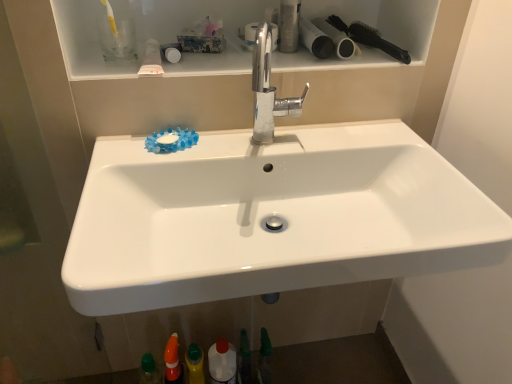
Question: Which direction should I rotate to look at metallic cylindrical container at upper center, arranged as the first toiletry when viewed from the top, — up or down?

Choices:
 (A) down
 (B) up

Answer: (B)

Question: Is the position of black plastic brush at upper right more distant than that of metallic cylindrical container at upper center, the 5th toiletry positioned from the left?

Choices:
 (A) yes
 (B) no

Answer: (B)

Question: From the image's perspective, is black plastic brush at upper right beneath metallic cylindrical container at upper center, positioned as the fifth toiletry in bottom-to-top order?

Choices:
 (A) no
 (B) yes

Answer: (A)

Question: Is black plastic brush at upper right shorter than metallic cylindrical container at upper center, positioned as the fifth toiletry in bottom-to-top order?

Choices:
 (A) no
 (B) yes

Answer: (B)

Question: Does black plastic brush at upper right have a smaller size compared to metallic cylindrical container at upper center, arranged as the first toiletry when viewed from the top?

Choices:
 (A) yes
 (B) no

Answer: (B)

Question: Is black plastic brush at upper right to the right of metallic cylindrical container at upper center, arranged as the first toiletry when viewed from the top, from the viewer's perspective?

Choices:
 (A) yes
 (B) no

Answer: (A)

Question: Does black plastic brush at upper right have a greater width compared to metallic cylindrical container at upper center, positioned as the fifth toiletry in bottom-to-top order?

Choices:
 (A) no
 (B) yes

Answer: (B)

Question: From the image's perspective, is matte white toilet paper at upper right, which is counted as the 2th toilet paper, starting from the right, below green matte toothpaste at lower center, which is counted as the fourth toiletry, starting from the bottom?

Choices:
 (A) no
 (B) yes

Answer: (A)

Question: Is matte white toilet paper at upper right, which is counted as the 2th toilet paper, starting from the right, to the left of green matte toothpaste at lower center, marked as the 2th toiletry in a top-to-bottom arrangement, from the viewer's perspective?

Choices:
 (A) no
 (B) yes

Answer: (A)

Question: Is the depth of matte white toilet paper at upper right, which is counted as the 2th toilet paper, starting from the right, less than that of green matte toothpaste at lower center, which is counted as the fourth toiletry, starting from the bottom?

Choices:
 (A) yes
 (B) no

Answer: (A)

Question: Is matte white toilet paper at upper right, which is counted as the 2th toilet paper, starting from the right, positioned beyond the bounds of green matte toothpaste at lower center, marked as the 2th toiletry in a top-to-bottom arrangement?

Choices:
 (A) yes
 (B) no

Answer: (A)

Question: Is matte white toilet paper at upper right, the 1th toilet paper viewed from the left, taller than green matte toothpaste at lower center, marked as the 2th toiletry in a top-to-bottom arrangement?

Choices:
 (A) yes
 (B) no

Answer: (B)

Question: From a real-world perspective, is matte white toilet paper at upper right, the 1th toilet paper viewed from the left, on top of green matte toothpaste at lower center, which is counted as the fourth toiletry, starting from the bottom?

Choices:
 (A) no
 (B) yes

Answer: (B)

Question: From a real-world perspective, does white glossy bottle at lower center stand above green matte bottle at lower center, which appears as the third toiletry when viewed from the top?

Choices:
 (A) no
 (B) yes

Answer: (A)